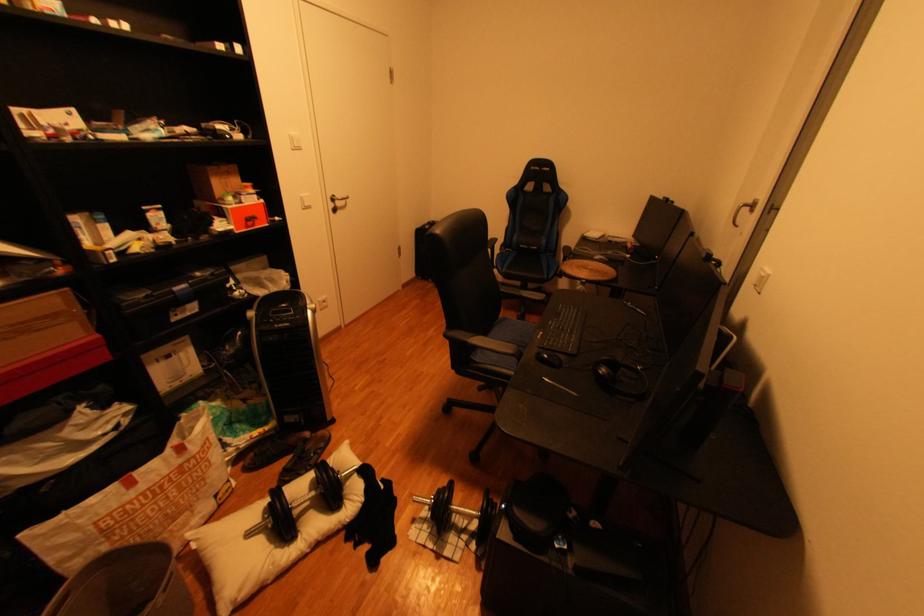
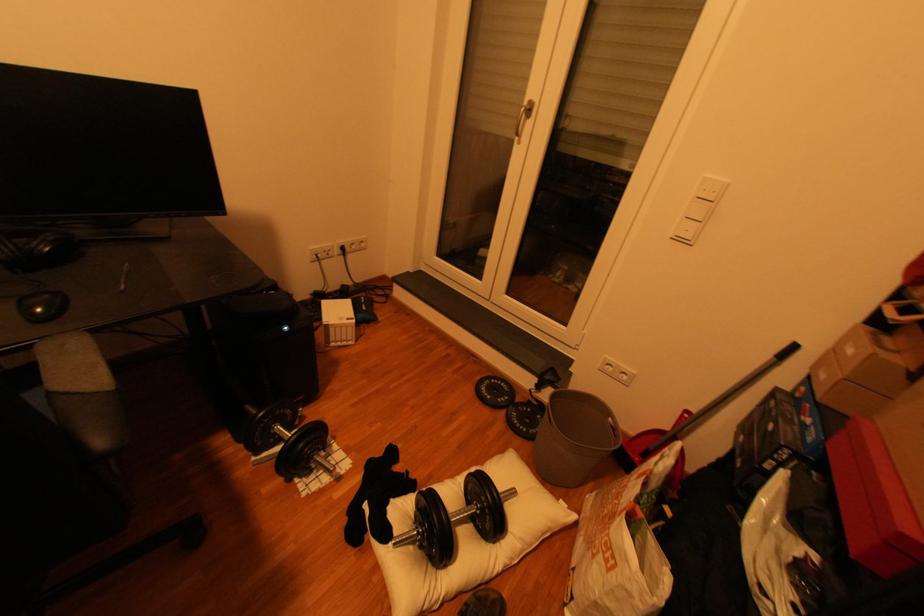
In the second image, find the point that corresponds to (x=365, y=476) in the first image.

(406, 533)